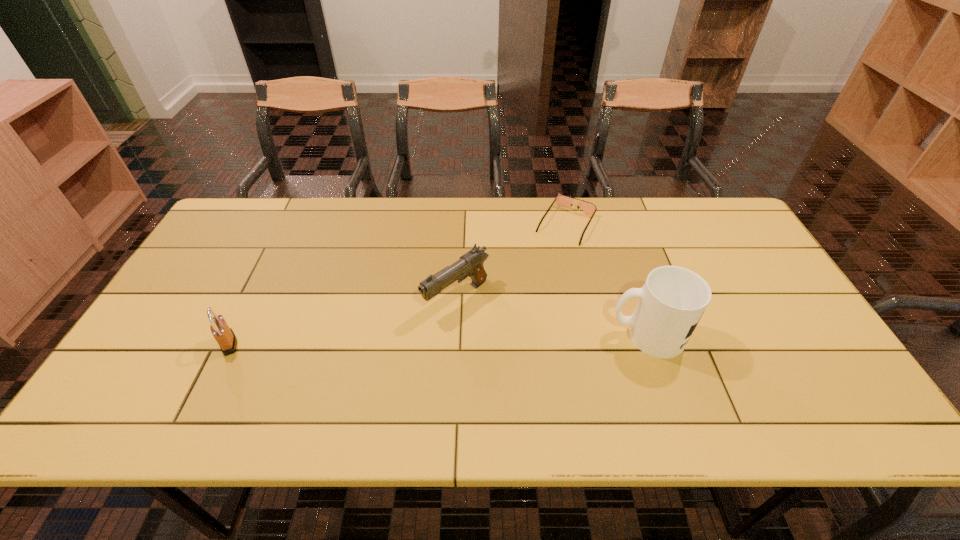
The image size is (960, 540). In order to click on empty location between the gun and the farthest object in this screenshot , I will do `click(512, 261)`.

Locate which object ranks second in proximity to the sunglasses. Please provide its 2D coordinates. Your answer should be formatted as a tuple, i.e. [(x, y)], where the tuple contains the x and y coordinates of a point satisfying the conditions above.

[(673, 299)]

I want to click on object that is the third closest to the padlock, so click(x=673, y=299).

Image resolution: width=960 pixels, height=540 pixels. I want to click on free point that satisfies the following two spatial constraints: 1. on the front side of the farthest object; 2. on the handle side of the tallest object, so click(x=591, y=335).

Identify the location of free space that satisfies the following two spatial constraints: 1. on the front side of the shortest object; 2. on the handle side of the mug. (591, 335).

Image resolution: width=960 pixels, height=540 pixels. In order to click on vacant region that satisfies the following two spatial constraints: 1. on the back side of the padlock; 2. on the handle side of the tallest object in this screenshot , I will do `click(233, 335)`.

Find the location of a particular element. Image resolution: width=960 pixels, height=540 pixels. free region that satisfies the following two spatial constraints: 1. on the front side of the mug; 2. on the handle side of the second object from left to right is located at coordinates (455, 335).

Find the location of a particular element. The image size is (960, 540). free point that satisfies the following two spatial constraints: 1. on the back side of the leftmost object; 2. on the handle side of the mug is located at coordinates [233, 335].

What are the coordinates of `vacant space that satisfies the following two spatial constraints: 1. on the back side of the leftmost object; 2. on the handle side of the tallest object` in the screenshot? It's located at (233, 335).